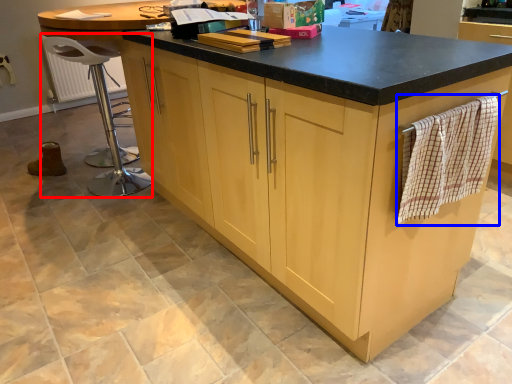
Question: Which point is further to the camera, bar stool (highlighted by a red box) or blanket (highlighted by a blue box)?

Choices:
 (A) bar stool
 (B) blanket

Answer: (A)